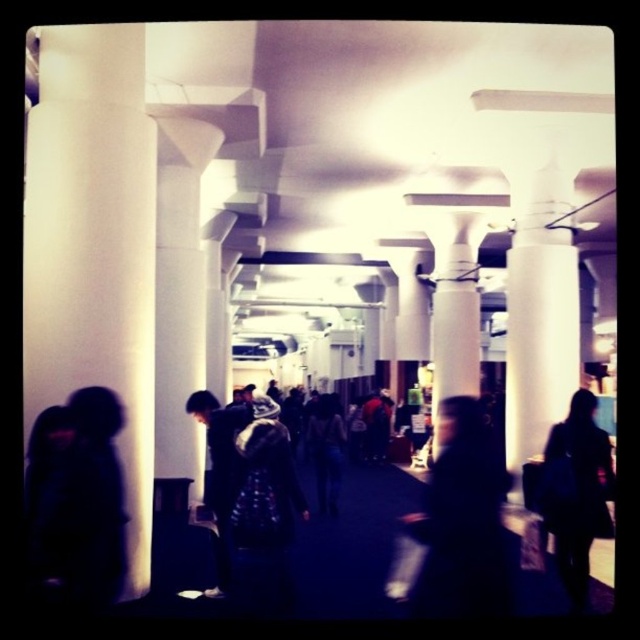
Is dark textured coat at left to the left of dark blue jacket at center from the viewer's perspective?

Correct, you'll find dark textured coat at left to the left of dark blue jacket at center.

Looking at this image, is dark textured coat at left smaller than dark blue jacket at center?

Indeed, dark textured coat at left has a smaller size compared to dark blue jacket at center.

Who is more distant from viewer, (x=54, y=520) or (x=360, y=412)?

Positioned behind is point (x=360, y=412).

The width and height of the screenshot is (640, 640). What are the coordinates of `dark textured coat at left` in the screenshot? It's located at (84, 502).

Is white smooth column at right further to camera compared to dark blue jacket at center?

No, it is not.

From the picture: Who is positioned more to the left, white smooth column at right or dark blue jacket at center?

Positioned to the left is dark blue jacket at center.

Between point (566, 360) and point (372, 449), which one is positioned behind?

The point (372, 449) is behind.

I want to click on white smooth column at right, so click(x=540, y=312).

Between black fabric backpack at right and dark blue fabric jacket at center, which one has more height?

Standing taller between the two is dark blue fabric jacket at center.

Locate an element on the screen. black fabric backpack at right is located at coordinates (577, 492).

Identify the location of black fabric backpack at right. (577, 492).